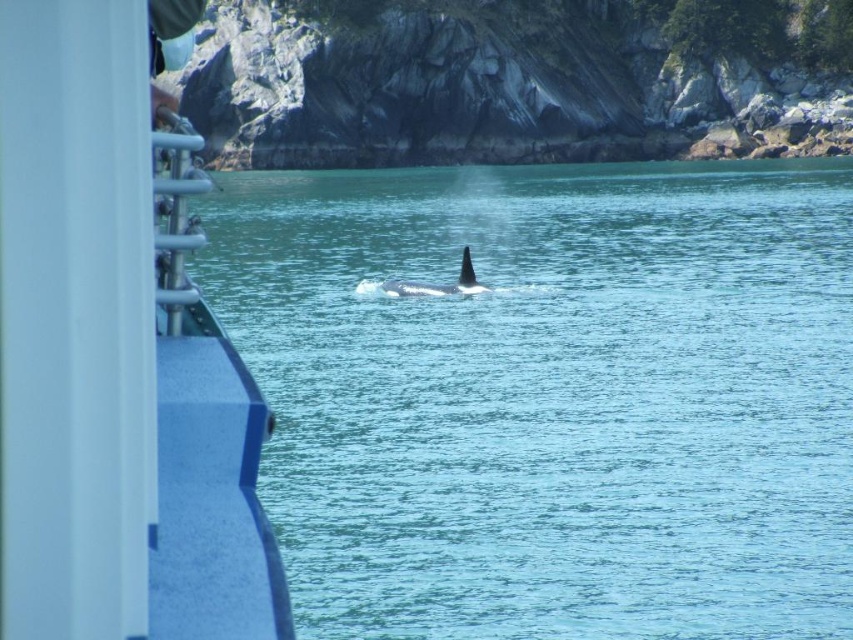
Looking at this image, you are standing on the deck of a boat and want to locate two points marked on the water surface. The first point is at coordinate point(376,548) and the second is at point(192,410). From your position on the boat deck, which point is closer to you?

Point(192,410) is closer to you because point(376,548) is behind it.

You are standing on the deck of a boat and see two points marked on the water. The first point is at coordinate point(131,356) and the second is at point(412,292). If you want to throw a lifebuoy towards the orca whale, which point should you aim for to ensure it reaches the whale first?

Point point(131,356) is in front of point(412,292), so you should aim for point(131,356) to ensure the lifebuoy reaches the whale first.

You are on a boat and want to determine the distance between two points in the water. You see a point at coordinates point (x=558, y=253) and another at point (x=386, y=291). Which point is closer to you?

Point (x=558, y=253) is further to the viewer than point (x=386, y=291), so the point at (x=386, y=291) is closer to you.